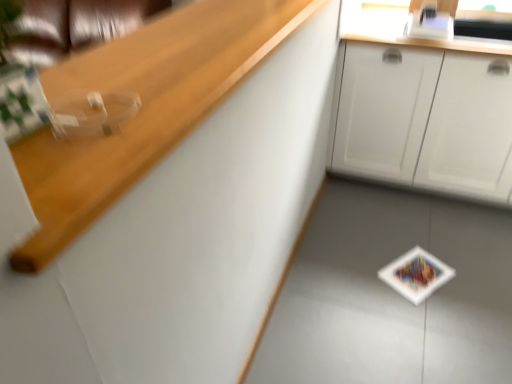
Question: From the image's perspective, is white matte cabinet at upper right under wooden at upper left?

Choices:
 (A) yes
 (B) no

Answer: (B)

Question: Is the depth of white matte cabinet at upper right less than that of wooden at upper left?

Choices:
 (A) no
 (B) yes

Answer: (A)

Question: From the image's perspective, is white matte cabinet at upper right above wooden at upper left?

Choices:
 (A) no
 (B) yes

Answer: (B)

Question: Is white matte cabinet at upper right surrounding wooden at upper left?

Choices:
 (A) no
 (B) yes

Answer: (A)

Question: Is white matte cabinet at upper right facing towards wooden at upper left?

Choices:
 (A) no
 (B) yes

Answer: (B)

Question: Is white matte cabinet at upper right outside of wooden at upper left?

Choices:
 (A) yes
 (B) no

Answer: (A)

Question: Is wooden at upper left placed right next to white matte cabinet at upper right?

Choices:
 (A) no
 (B) yes

Answer: (A)

Question: Can you confirm if wooden at upper left is taller than white matte cabinet at upper right?

Choices:
 (A) no
 (B) yes

Answer: (A)

Question: Does wooden at upper left appear on the left side of white matte cabinet at upper right?

Choices:
 (A) yes
 (B) no

Answer: (A)

Question: From the image's perspective, does wooden at upper left appear higher than white matte cabinet at upper right?

Choices:
 (A) yes
 (B) no

Answer: (B)

Question: From the image's perspective, does wooden at upper left appear lower than white matte cabinet at upper right?

Choices:
 (A) yes
 (B) no

Answer: (A)

Question: Considering the relative sizes of wooden at upper left and white matte cabinet at upper right in the image provided, is wooden at upper left shorter than white matte cabinet at upper right?

Choices:
 (A) yes
 (B) no

Answer: (A)

Question: From a real-world perspective, relative to wooden at upper left, is white matte cabinet at upper right vertically above or below?

Choices:
 (A) above
 (B) below

Answer: (B)